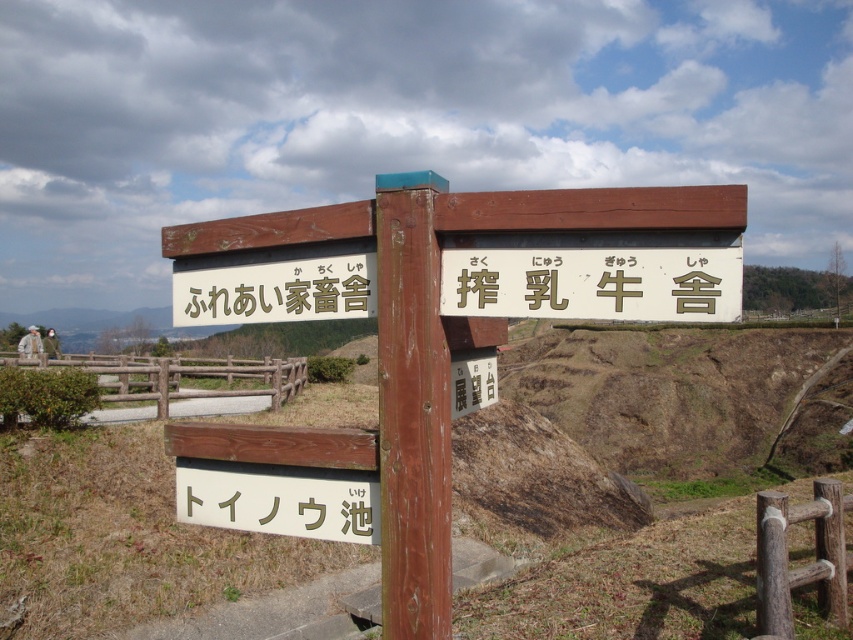
Is wooden post at center below brown wooden sign at center?

A: Incorrect, wooden post at center is not positioned below brown wooden sign at center.

Image resolution: width=853 pixels, height=640 pixels. Describe the element at coordinates (412, 410) in the screenshot. I see `wooden post at center` at that location.

Does point (397, 262) come behind point (492, 364)?

No, (397, 262) is closer to viewer.

This screenshot has height=640, width=853. In order to click on wooden post at center in this screenshot , I will do `click(412, 410)`.

Who is higher up, white wood sign at lower center or brown wooden sign at center?

Positioned higher is brown wooden sign at center.

Which is in front, point (294, 534) or point (486, 356)?

Point (294, 534) is more forward.

You are a GUI agent. You are given a task and a screenshot of the screen. Output one action in this format:
    pyautogui.click(x=<x>, y=<y>)
    Task: Click on the white wood sign at lower center
    
    Given the screenshot: What is the action you would take?
    pyautogui.click(x=279, y=499)

What do you see at coordinates (424, 340) in the screenshot?
I see `wooden sign at center` at bounding box center [424, 340].

Is wooden sign at center shorter than brown wooden sign at center?

Incorrect, wooden sign at center's height does not fall short of brown wooden sign at center's.

Who is more forward, (381, 230) or (473, 390)?

Point (381, 230)

The image size is (853, 640). What are the coordinates of `wooden sign at center` in the screenshot? It's located at (424, 340).